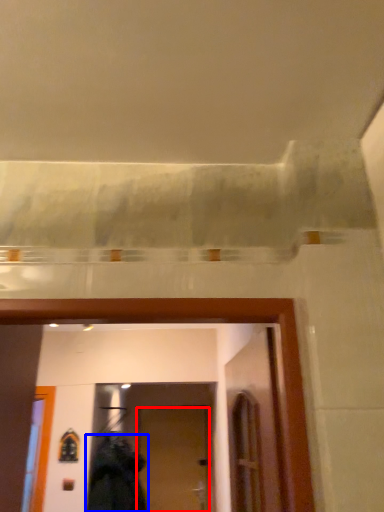
Question: Which of the following is the closest to the observer, door (highlighted by a red box) or clothing (highlighted by a blue box)?

Choices:
 (A) door
 (B) clothing

Answer: (B)